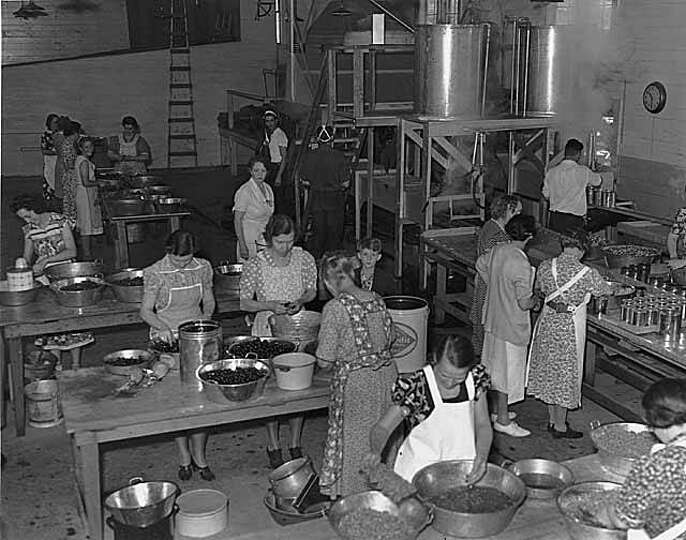
At what (x,y) coordinates should I click in order to perform the action: click on aprons. Please return your answer as a coordinate pair (x, y). The width and height of the screenshot is (686, 540). Looking at the image, I should click on (449, 446), (578, 322), (282, 292), (333, 422), (182, 310), (93, 205), (129, 151).